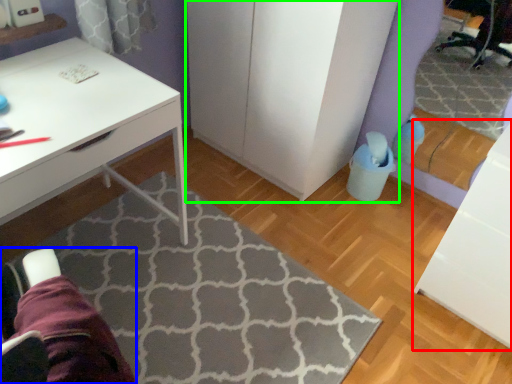
Question: Which is farther away from file cabinet (highlighted by a red box)? swivel chair (highlighted by a blue box) or dresser (highlighted by a green box)?

Choices:
 (A) swivel chair
 (B) dresser

Answer: (A)